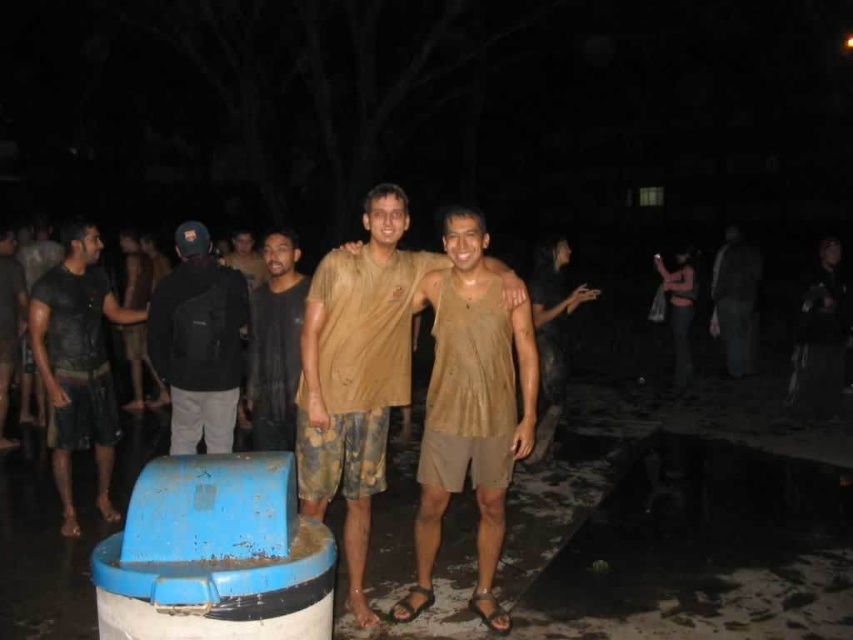
Does brown matte shirt at center have a larger size compared to dark brown leather jacket at left?

Correct, brown matte shirt at center is larger in size than dark brown leather jacket at left.

Who is more distant from viewer, (390, 401) or (22, 280)?

Point (22, 280)

Who is more forward, (x=397, y=316) or (x=16, y=289)?

Positioned in front is point (x=397, y=316).

Locate an element on the screen. This screenshot has width=853, height=640. brown matte shirt at center is located at coordinates (357, 372).

Based on the photo, is black fabric backpack at left bigger than dark gray fabric pants at right?

No, black fabric backpack at left is not bigger than dark gray fabric pants at right.

Between point (149, 330) and point (741, 291), which one is positioned behind?

Positioned behind is point (741, 291).

Is point (225, 451) positioned in front of point (753, 269)?

Yes, it is in front of point (753, 269).

Locate an element on the screen. black fabric backpack at left is located at coordinates (198, 342).

Is the position of dark matte t-shirt at left less distant than that of dark gray fabric pants at right?

Yes, it is in front of dark gray fabric pants at right.

Is the position of dark matte t-shirt at left more distant than that of dark gray fabric pants at right?

No.

Find the location of a particular element. dark matte t-shirt at left is located at coordinates (77, 364).

Where is `dark matte t-shirt at left`? dark matte t-shirt at left is located at coordinates (77, 364).